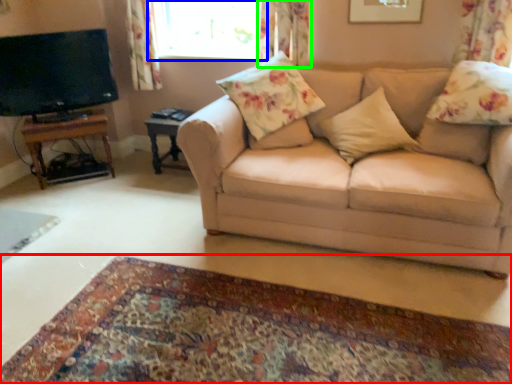
Question: Considering the real-world distances, which object is closest to plain (highlighted by a red box)? window (highlighted by a blue box) or curtain (highlighted by a green box).

Choices:
 (A) window
 (B) curtain

Answer: (B)